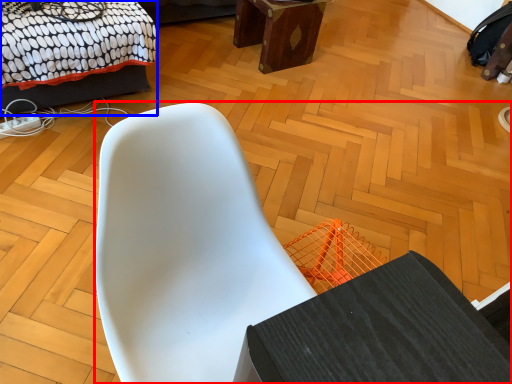
Question: Which object is closer to the camera taking this photo, chair (highlighted by a red box) or bed (highlighted by a blue box)?

Choices:
 (A) chair
 (B) bed

Answer: (A)